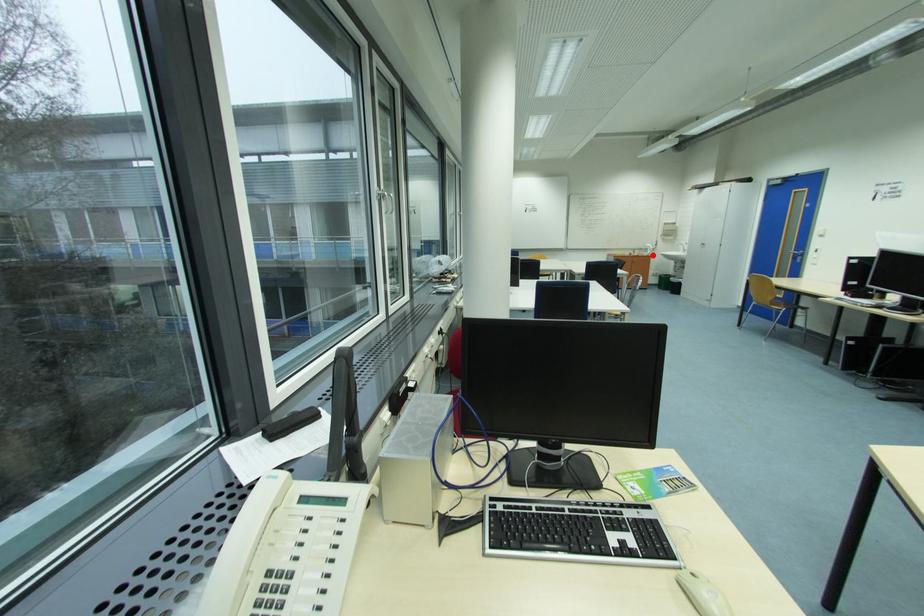
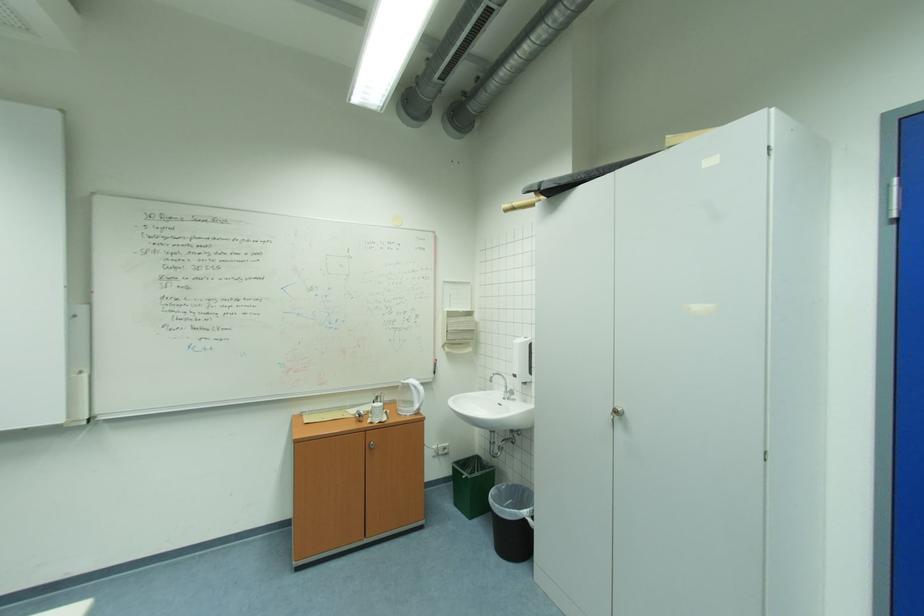
Find the pixel in the second image that matches the highlighted location in the first image.

(415, 411)